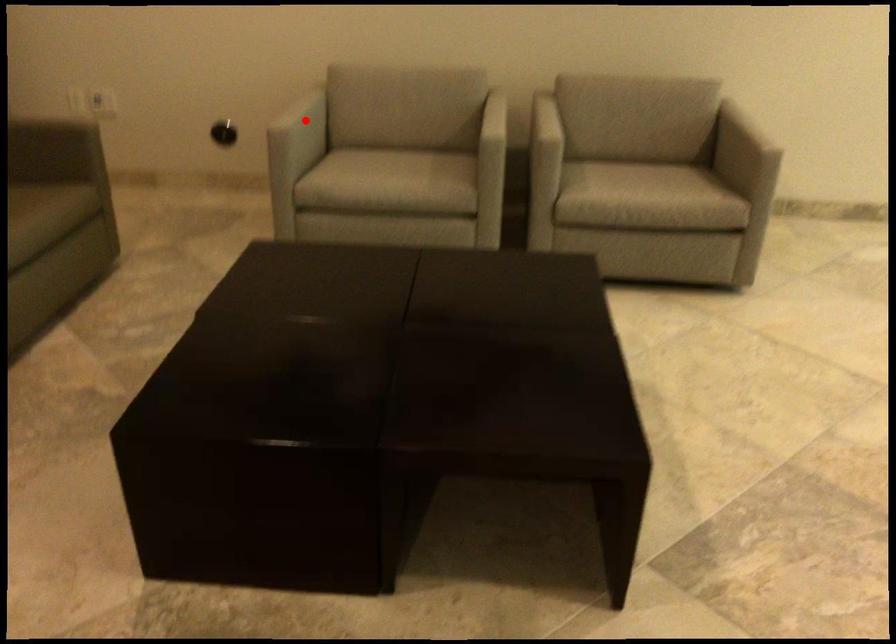
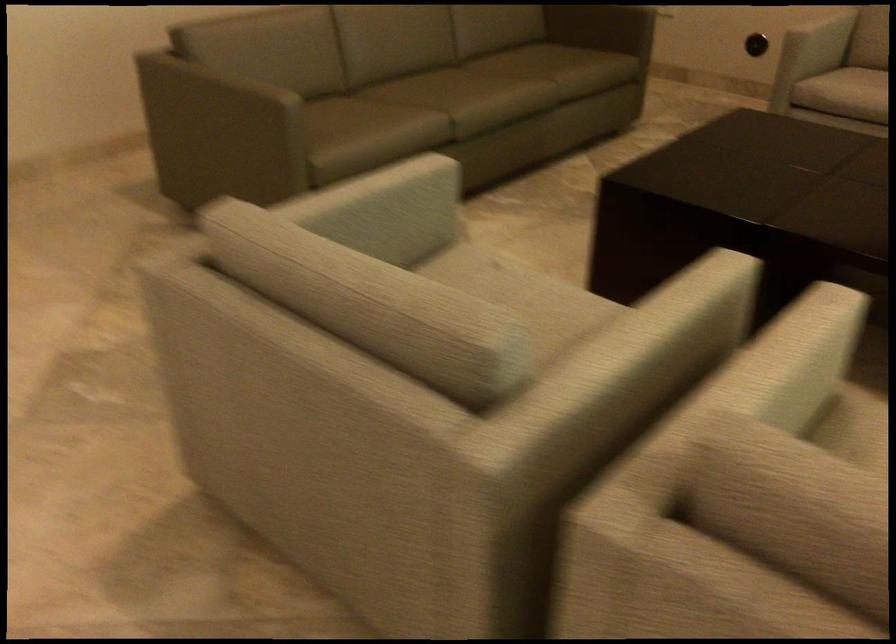
Locate, in the second image, the point that corresponds to the highlighted location in the first image.

(821, 35)